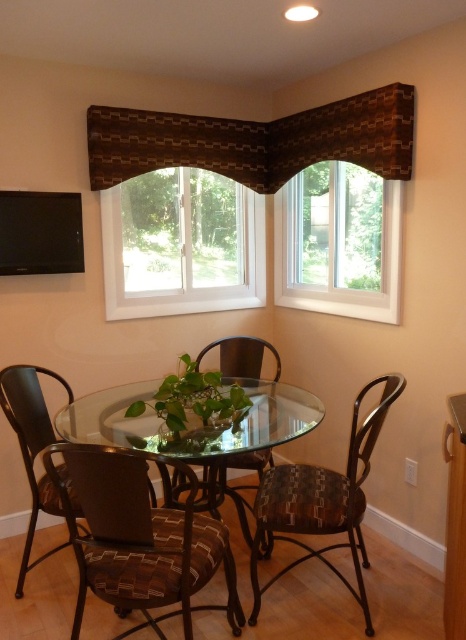
Question: Can you confirm if brown textured valance at center is positioned above brown woven cushion at lower left?

Choices:
 (A) yes
 (B) no

Answer: (A)

Question: Which point is farther from the camera taking this photo?

Choices:
 (A) (27, 404)
 (B) (305, 557)

Answer: (A)

Question: Among these objects, which one is nearest to the camera?

Choices:
 (A) green matte plant at center
 (B) brown textured valance at upper center
 (C) woven fabric chair at center

Answer: (A)

Question: Does brown textured valance at center have a larger size compared to patterned fabric chair at center?

Choices:
 (A) yes
 (B) no

Answer: (B)

Question: Which point appears closest to the camera in this image?

Choices:
 (A) (186, 301)
 (B) (116, 129)

Answer: (B)

Question: Considering the relative positions of white glass window at upper center and transparent glass table at center in the image provided, where is white glass window at upper center located with respect to transparent glass table at center?

Choices:
 (A) right
 (B) left

Answer: (A)